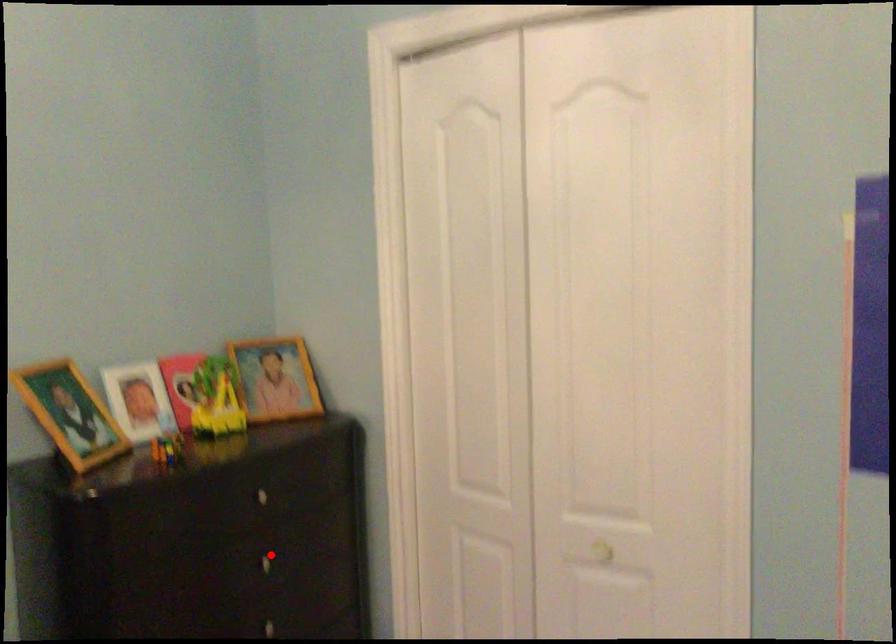
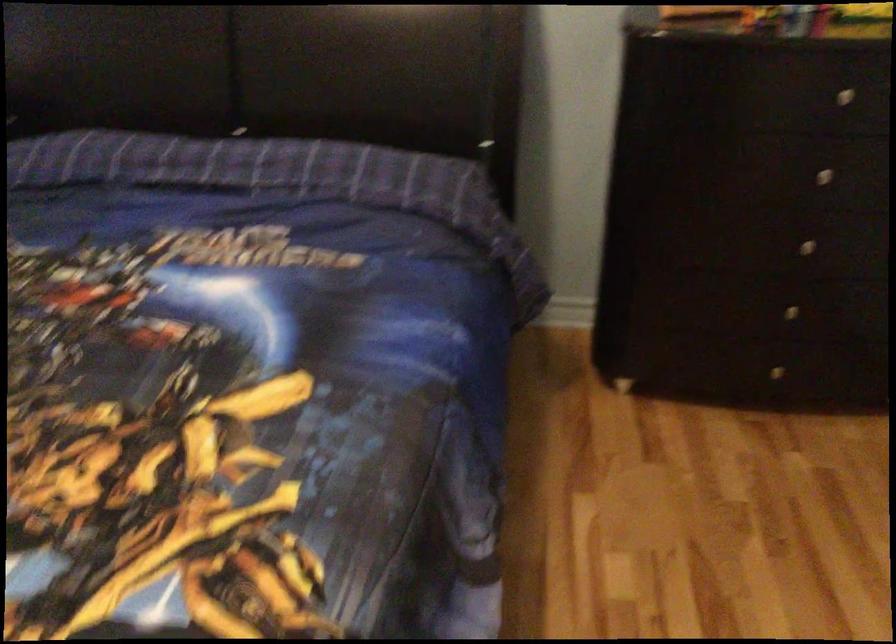
Locate, in the second image, the point that corresponds to the highlighted location in the first image.

(833, 169)